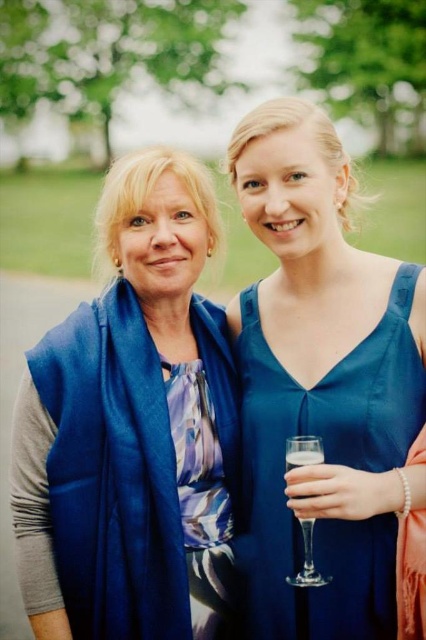
Question: Which of the following is the farthest from the observer?

Choices:
 (A) 294,465
 (B) 322,448
 (C) 259,364

Answer: (C)

Question: Which of the following is the farthest from the observer?

Choices:
 (A) (293, 467)
 (B) (209, 435)

Answer: (B)

Question: Among these objects, which one is nearest to the camera?

Choices:
 (A) blue fabric scarf at left
 (B) satin blue dress at right

Answer: (B)

Question: Observing the image, what is the correct spatial positioning of clear glass wine glass at right in reference to clear glass champagne flute at center?

Choices:
 (A) right
 (B) left

Answer: (A)

Question: Can you confirm if clear glass wine glass at right is smaller than clear glass champagne flute at center?

Choices:
 (A) yes
 (B) no

Answer: (B)

Question: Does blue fabric scarf at left appear on the left side of satin blue dress at right?

Choices:
 (A) no
 (B) yes

Answer: (B)